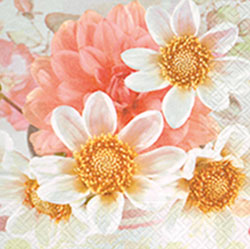
Locate an element on the screen. Image resolution: width=250 pixels, height=249 pixels. floral tablecloth is located at coordinates (31, 33).